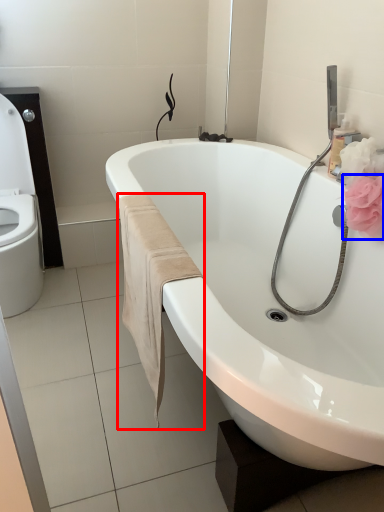
Question: Which object is further to the camera taking this photo, bath towel (highlighted by a red box) or flower (highlighted by a blue box)?

Choices:
 (A) bath towel
 (B) flower

Answer: (B)